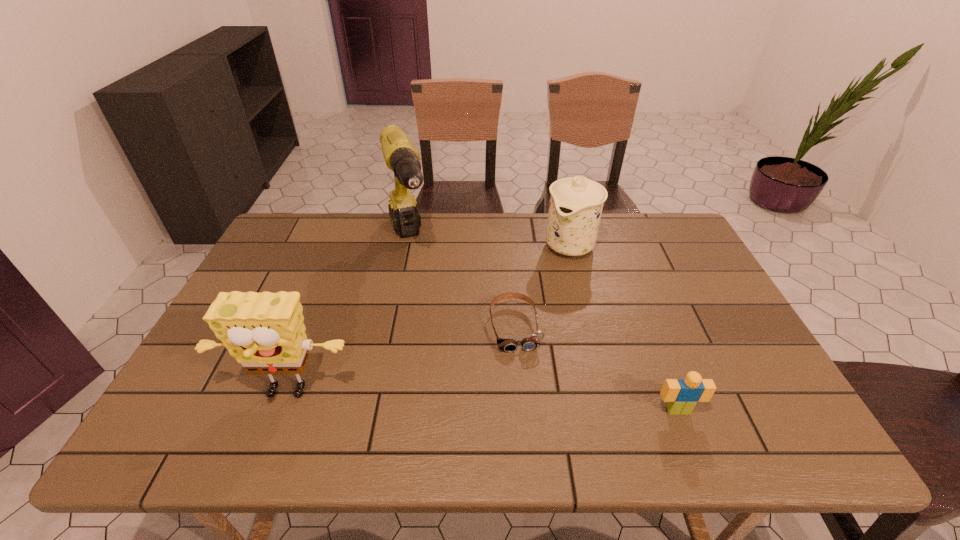
The height and width of the screenshot is (540, 960). I want to click on sponge, so click(265, 332).

Locate an element on the screen. Lego is located at coordinates (682, 395).

In order to click on the second shortest object in this screenshot , I will do `click(682, 395)`.

Image resolution: width=960 pixels, height=540 pixels. In order to click on goggles in this screenshot , I will do `click(532, 341)`.

I want to click on the shortest object, so click(532, 341).

This screenshot has width=960, height=540. In order to click on the fourth object from left to right in this screenshot , I will do `click(576, 203)`.

Image resolution: width=960 pixels, height=540 pixels. What are the coordinates of `drill` in the screenshot? It's located at (401, 156).

Identify the location of free location located on the front-facing side of the third object from left to right. (523, 369).

Where is `blank area located on the front-facing side of the third object from left to right`? The image size is (960, 540). blank area located on the front-facing side of the third object from left to right is located at coordinates (525, 376).

At what (x,y) coordinates should I click in order to perform the action: click on free space located 0.220m on the spout of the chinaware. Please return your answer as a coordinate pair (x, y). Looking at the image, I should click on pyautogui.click(x=528, y=306).